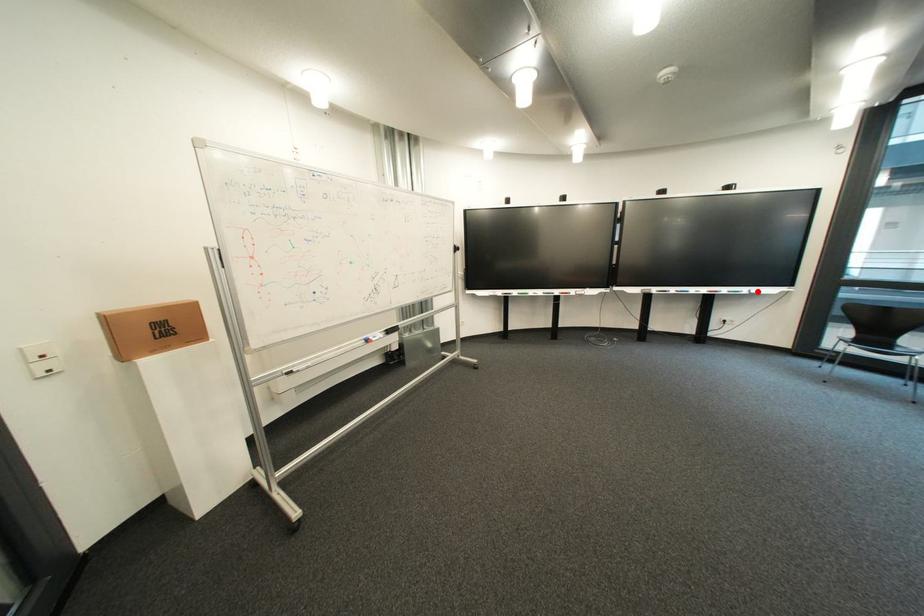
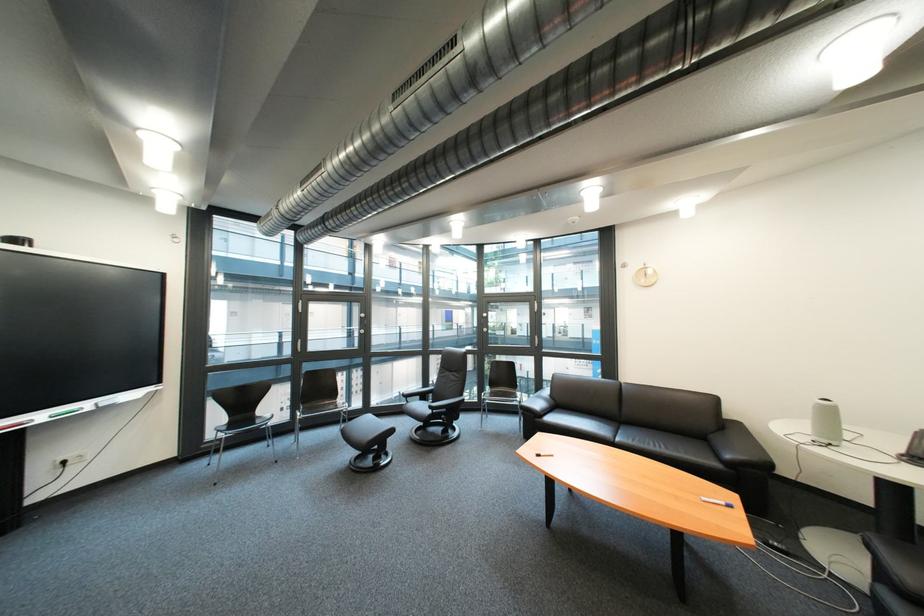
Where in the second image is the point corresponding to the highlighted location from the first image?

(101, 406)